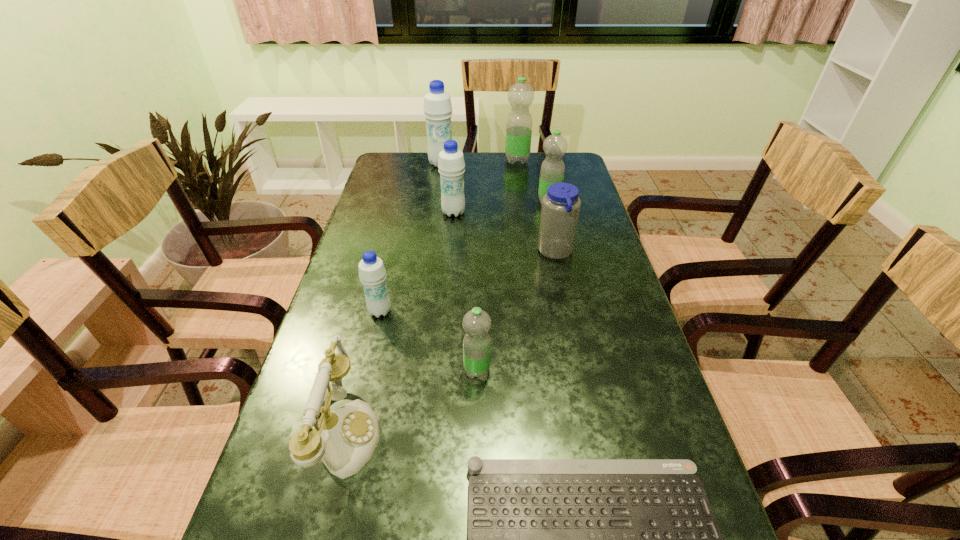
Where is `the farthest green water bottle`? Image resolution: width=960 pixels, height=540 pixels. the farthest green water bottle is located at coordinates (520, 95).

The width and height of the screenshot is (960, 540). Find the location of `the second green water bottle from left to right`. the second green water bottle from left to right is located at coordinates (520, 95).

The width and height of the screenshot is (960, 540). I want to click on the biggest blue water bottle, so click(x=437, y=108).

This screenshot has height=540, width=960. I want to click on the second biggest green water bottle, so click(x=552, y=170).

Where is `the rightmost green water bottle`? The width and height of the screenshot is (960, 540). the rightmost green water bottle is located at coordinates (552, 170).

At what (x,y) coordinates should I click in order to perform the action: click on the third nearest blue water bottle. Please return your answer as a coordinate pair (x, y). Looking at the image, I should click on pos(451,164).

Identify the location of the rightmost blue water bottle. (560, 209).

Where is `the fifth farthest water bottle`? This screenshot has width=960, height=540. the fifth farthest water bottle is located at coordinates (560, 209).

Locate an element on the screen. This screenshot has width=960, height=540. the leftmost blue water bottle is located at coordinates (372, 273).

The image size is (960, 540). In order to click on the sixth farthest object in this screenshot , I will do `click(372, 273)`.